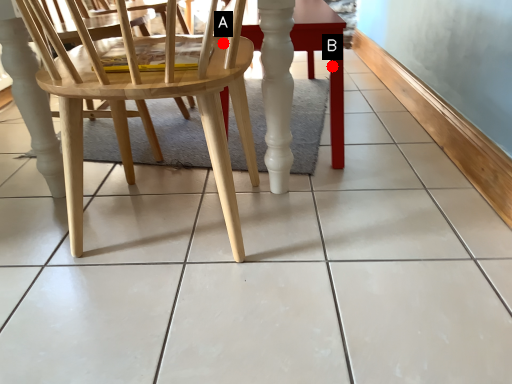
Question: Two points are circled on the image, labeled by A and B beside each circle. Which point is closer to the camera?

Choices:
 (A) A is closer
 (B) B is closer

Answer: (A)